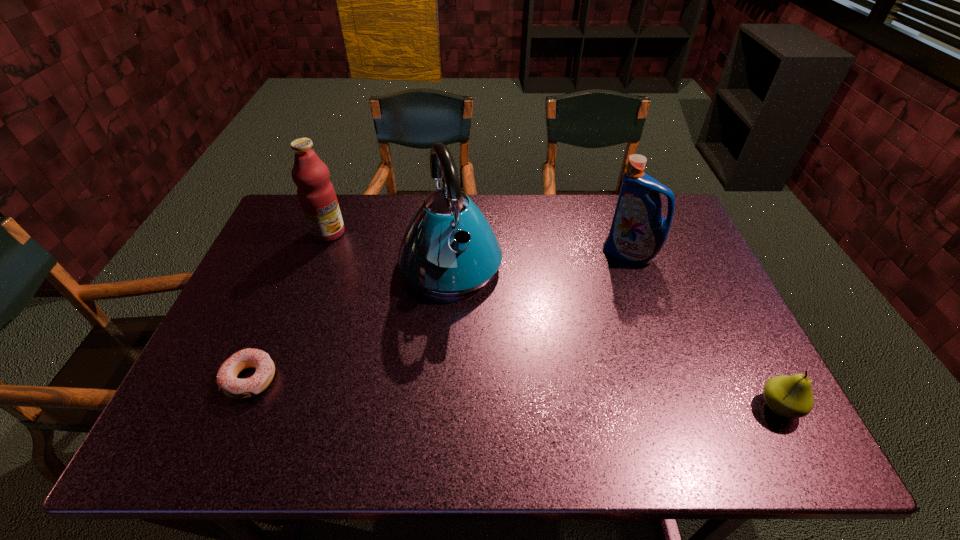
Image resolution: width=960 pixels, height=540 pixels. I want to click on free space at the left edge of the desktop, so click(280, 341).

This screenshot has height=540, width=960. In order to click on free space at the right edge of the desktop in this screenshot , I will do `click(725, 330)`.

Locate an element on the screen. The width and height of the screenshot is (960, 540). empty space that is in between the rightmost object and the third object from left to right is located at coordinates (614, 335).

The width and height of the screenshot is (960, 540). Identify the location of vacant area between the detergent and the shortest object. (440, 316).

This screenshot has height=540, width=960. I want to click on free space that is in between the doughnut and the pear, so click(x=515, y=393).

This screenshot has height=540, width=960. Identify the location of unoccupied position between the doughnut and the second object from right to left. (440, 316).

Identify the location of empty location between the shortest object and the third object from left to right. (350, 321).

Find the location of a particular element. vacant space in between the detergent and the rightmost object is located at coordinates (704, 331).

At what (x,y) coordinates should I click in order to perform the action: click on free space between the tallest object and the doughnut. Please return your answer as a coordinate pair (x, y). Looking at the image, I should click on (350, 321).

Where is `vacant space that is in between the rightmost object and the fruit juice`? vacant space that is in between the rightmost object and the fruit juice is located at coordinates (553, 320).